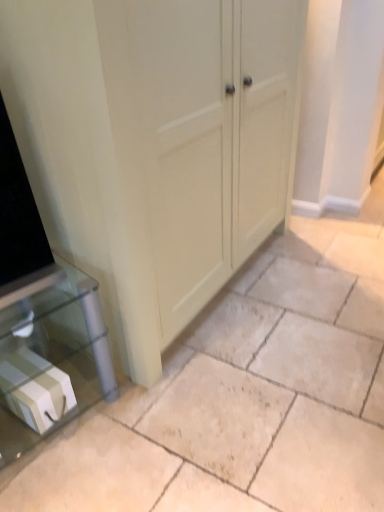
Question: Would you say white glossy box at lower left is part of beige tile floor at center's contents?

Choices:
 (A) yes
 (B) no

Answer: (B)

Question: Considering the relative sizes of beige tile floor at center and white glossy box at lower left in the image provided, is beige tile floor at center taller than white glossy box at lower left?

Choices:
 (A) yes
 (B) no

Answer: (B)

Question: Can you confirm if beige tile floor at center is wider than white glossy box at lower left?

Choices:
 (A) no
 (B) yes

Answer: (B)

Question: From a real-world perspective, is beige tile floor at center on white glossy box at lower left?

Choices:
 (A) yes
 (B) no

Answer: (B)

Question: From a real-world perspective, is beige tile floor at center beneath white glossy box at lower left?

Choices:
 (A) yes
 (B) no

Answer: (A)

Question: Which is correct: beige tile floor at center is inside white glossy box at lower left, or outside of it?

Choices:
 (A) outside
 (B) inside

Answer: (A)

Question: In the image, is beige tile floor at center positioned in front of or behind white glossy box at lower left?

Choices:
 (A) behind
 (B) front

Answer: (B)

Question: From the image's perspective, is beige tile floor at center above or below white glossy box at lower left?

Choices:
 (A) below
 (B) above

Answer: (B)

Question: From a real-world perspective, is beige tile floor at center above or below white glossy box at lower left?

Choices:
 (A) below
 (B) above

Answer: (A)

Question: Is matte cream cupboard at center situated inside white glossy box at lower left or outside?

Choices:
 (A) outside
 (B) inside

Answer: (A)

Question: In terms of size, does matte cream cupboard at center appear bigger or smaller than white glossy box at lower left?

Choices:
 (A) big
 (B) small

Answer: (A)

Question: From a real-world perspective, relative to white glossy box at lower left, is matte cream cupboard at center vertically above or below?

Choices:
 (A) above
 (B) below

Answer: (A)

Question: Is matte cream cupboard at center taller or shorter than white glossy box at lower left?

Choices:
 (A) tall
 (B) short

Answer: (A)

Question: Considering the positions of point (289, 397) and point (134, 350), is point (289, 397) closer or farther from the camera than point (134, 350)?

Choices:
 (A) farther
 (B) closer

Answer: (B)

Question: From a real-world perspective, is beige tile floor at center positioned above or below matte cream cupboard at center?

Choices:
 (A) above
 (B) below

Answer: (B)